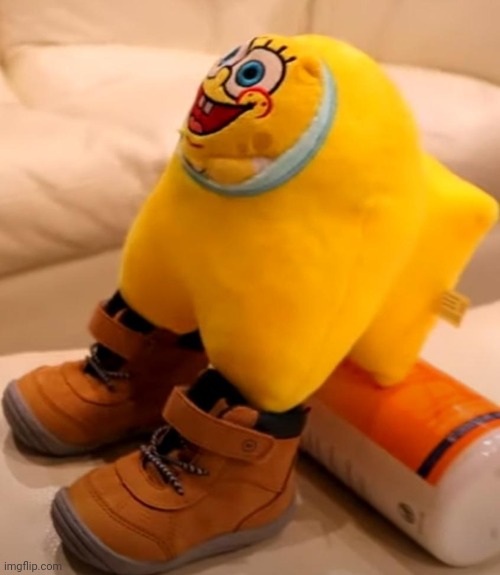
In order to click on bottle in this screenshot , I will do `click(395, 478)`.